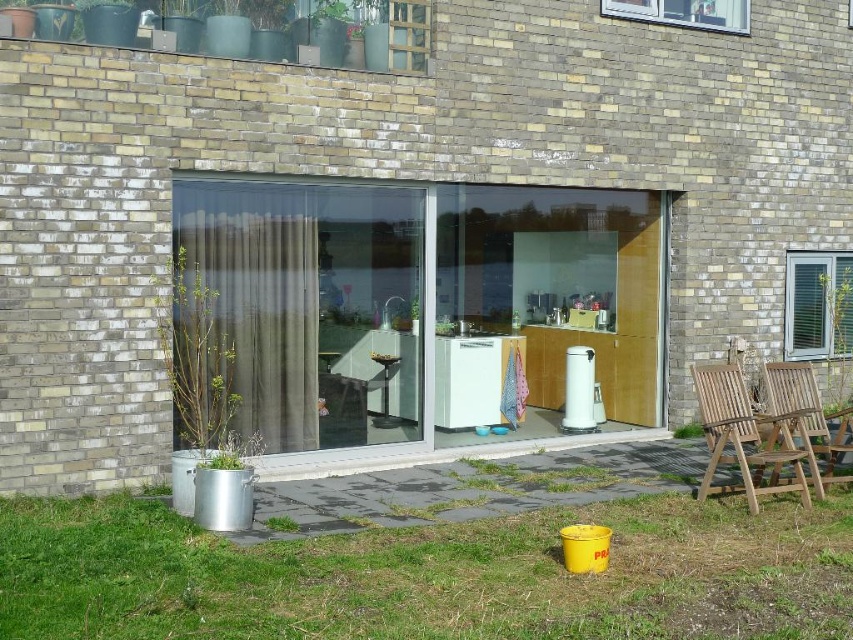
You are standing on the patio and want to sit down on the metallic silver stool at center. To your right, there is a wooden bench. Which direction should you move to reach the stool from the transparent glass door at center?

The transparent glass door at center is positioned on the left side of metallic silver stool at center, so you should move to the right from the transparent glass door at center to reach the metallic silver stool at center.

You are standing directly in front of the transparent glass door at center. If you want to enter the building, which direction should you walk relative to your current position?

Since you are already standing directly in front of the transparent glass door at center, you should walk forward towards it to enter the building.

You are planning to place a small table between the teak wood chairs at lower right and the teak wood chair at lower right. Is there enough space for the table?

The teak wood chairs at lower right is positioned under teak wood chair at lower right, so there is no space between them to place a table.